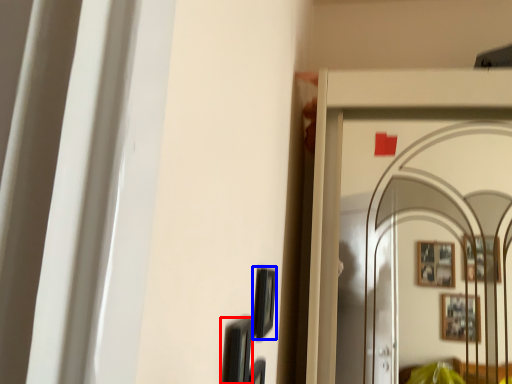
Question: Which point is further to the camera, picture frame (highlighted by a red box) or picture frame (highlighted by a blue box)?

Choices:
 (A) picture frame
 (B) picture frame

Answer: (B)